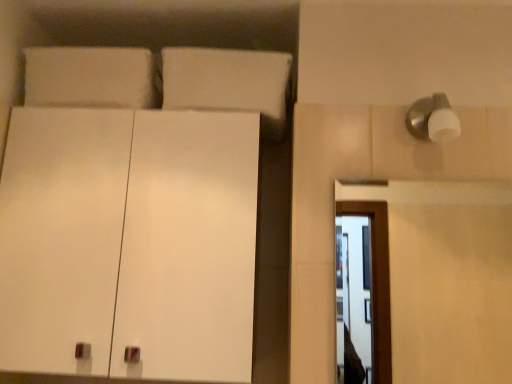
Describe the element at coordinates (129, 242) in the screenshot. I see `white glossy cabinet at left` at that location.

This screenshot has width=512, height=384. What are the coordinates of `white glossy cabinet at left` in the screenshot? It's located at (129, 242).

The image size is (512, 384). Identify the location of white glossy cabinet at left. (129, 242).